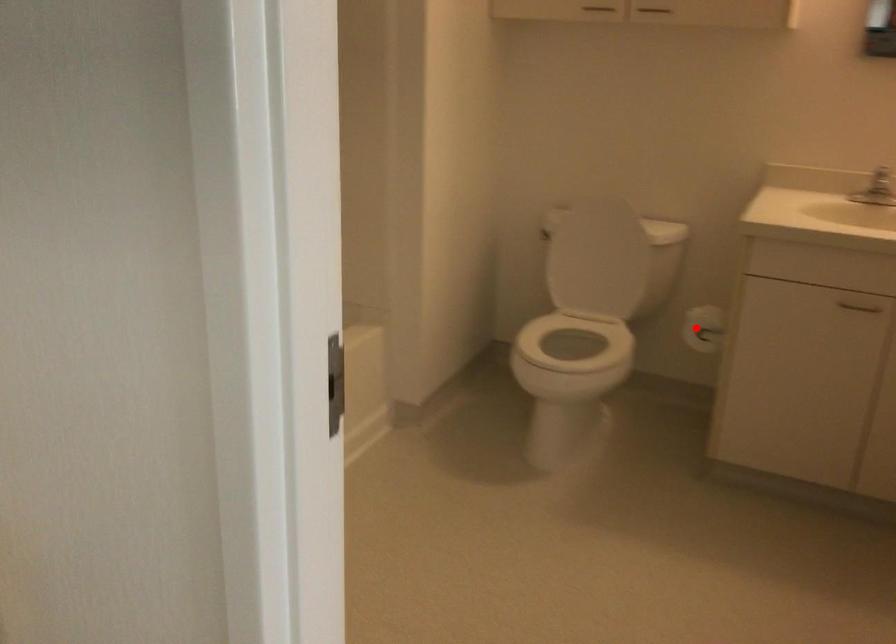
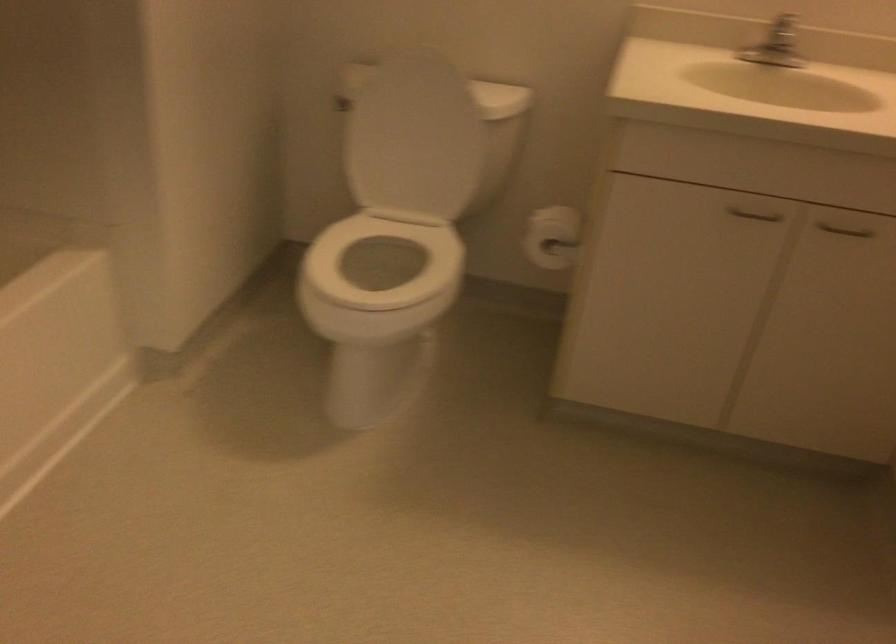
Locate, in the second image, the point that corresponds to the highlighted location in the first image.

(552, 237)